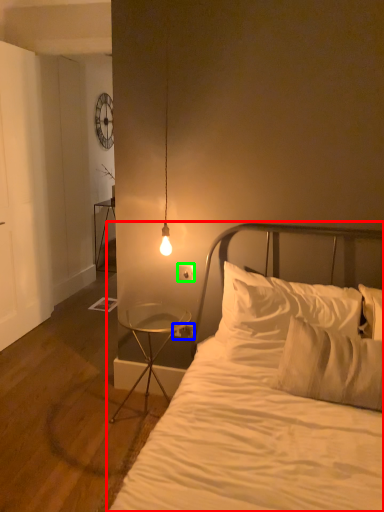
Question: Which is nearer to the bed (highlighted by a red box)? electric outlet (highlighted by a blue box) or electric outlet (highlighted by a green box).

Choices:
 (A) electric outlet
 (B) electric outlet

Answer: (B)